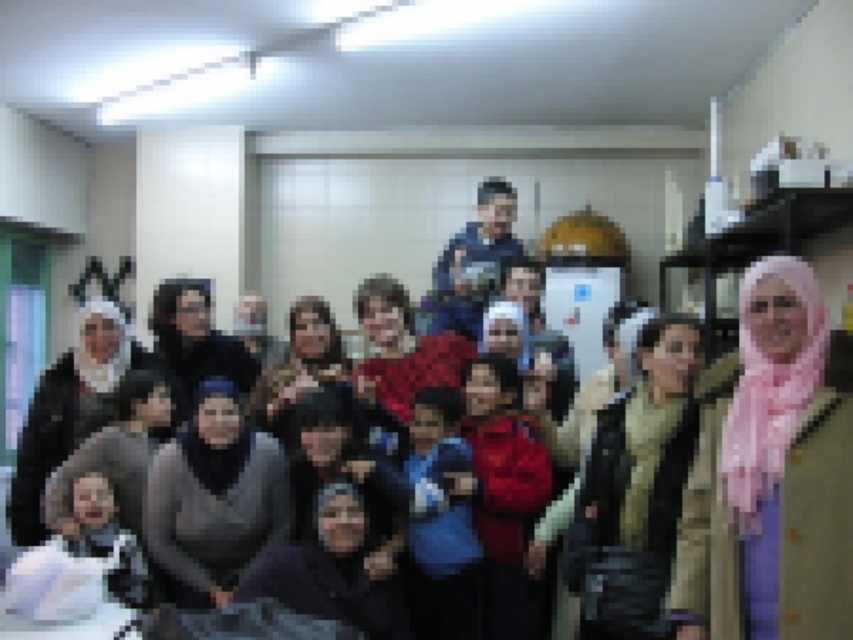
Question: Is pink fabric hijab at center below gray matte hijab at center?

Choices:
 (A) no
 (B) yes

Answer: (A)

Question: Is pink fabric hijab at center above gray matte hijab at center?

Choices:
 (A) yes
 (B) no

Answer: (A)

Question: Does pink fabric hijab at center appear over gray matte hijab at center?

Choices:
 (A) no
 (B) yes

Answer: (B)

Question: Which of the following is the closest to the observer?

Choices:
 (A) (759, 326)
 (B) (202, 506)

Answer: (A)

Question: Which of the following is the farthest from the observer?

Choices:
 (A) gray matte hijab at center
 (B) pink fabric hijab at center

Answer: (A)